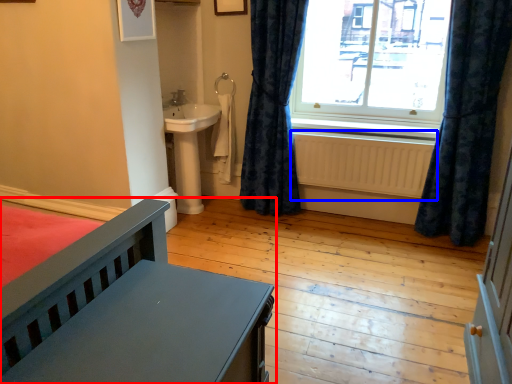
Question: Which point is further to the camera, furniture (highlighted by a red box) or radiator (highlighted by a blue box)?

Choices:
 (A) furniture
 (B) radiator

Answer: (B)